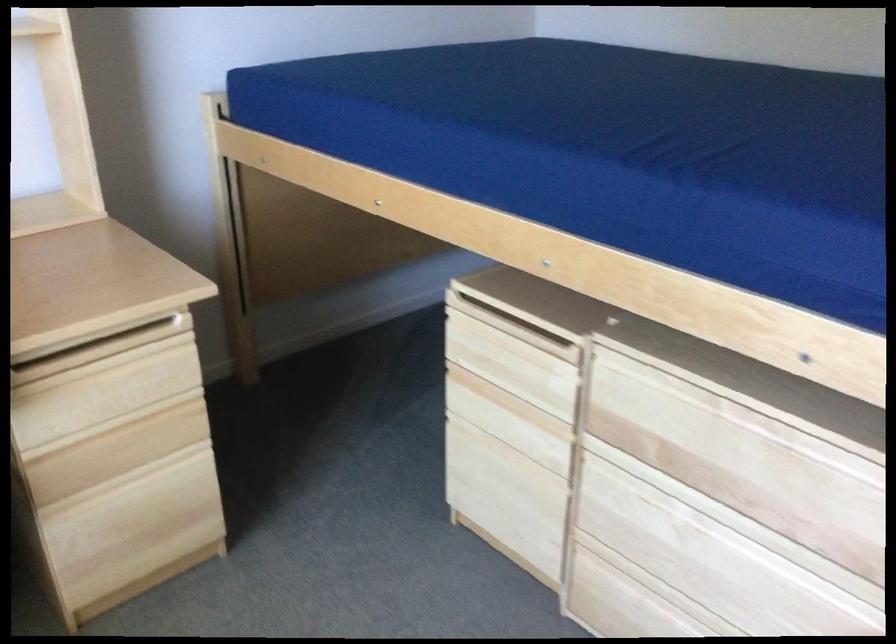
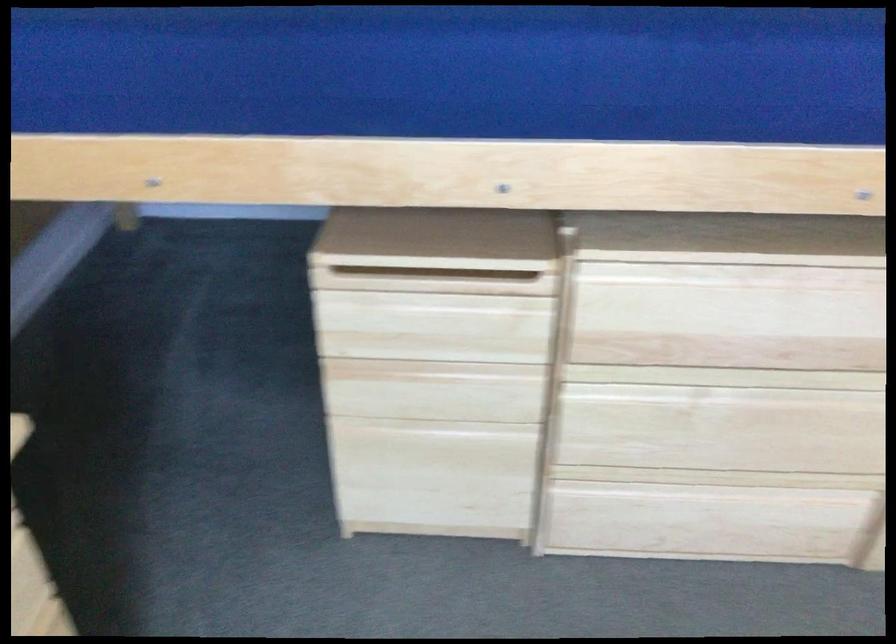
Where in the second image is the point corresponding to (x=712, y=404) from the first image?

(737, 277)